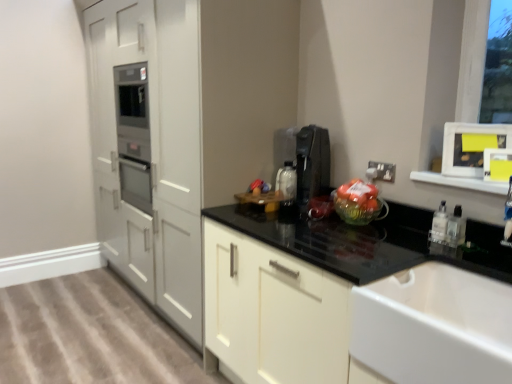
Question: Is white plastic electric outlet at upper right not inside clear plastic bottle at right, which is the 2th bottle from right to left?

Choices:
 (A) yes
 (B) no

Answer: (A)

Question: Is white plastic electric outlet at upper right at the left side of clear plastic bottle at right, the first bottle when ordered from left to right?

Choices:
 (A) no
 (B) yes

Answer: (B)

Question: Is clear plastic bottle at right, the first bottle when ordered from left to right, inside white plastic electric outlet at upper right?

Choices:
 (A) no
 (B) yes

Answer: (A)

Question: Is white plastic electric outlet at upper right in front of clear plastic bottle at right, which is the 2th bottle from right to left?

Choices:
 (A) no
 (B) yes

Answer: (A)

Question: Is white plastic electric outlet at upper right turned away from clear plastic bottle at right, the first bottle when ordered from left to right?

Choices:
 (A) yes
 (B) no

Answer: (B)

Question: Is translucent glass bowl at center inside the boundaries of black plastic coffee machine at upper right, or outside?

Choices:
 (A) inside
 (B) outside

Answer: (B)

Question: From a real-world perspective, relative to black plastic coffee machine at upper right, is translucent glass bowl at center vertically above or below?

Choices:
 (A) above
 (B) below

Answer: (B)

Question: Would you say translucent glass bowl at center is to the left or to the right of black plastic coffee machine at upper right in the picture?

Choices:
 (A) right
 (B) left

Answer: (A)

Question: Relative to black plastic coffee machine at upper right, is translucent glass bowl at center in front or behind?

Choices:
 (A) front
 (B) behind

Answer: (A)

Question: In terms of width, does black glossy countertop at center look wider or thinner when compared to black plastic coffee machine at upper right?

Choices:
 (A) wide
 (B) thin

Answer: (A)

Question: Do you think black glossy countertop at center is within black plastic coffee machine at upper right, or outside of it?

Choices:
 (A) inside
 (B) outside

Answer: (B)

Question: Based on their sizes in the image, would you say black glossy countertop at center is bigger or smaller than black plastic coffee machine at upper right?

Choices:
 (A) small
 (B) big

Answer: (B)

Question: Is point (395, 273) closer or farther from the camera than point (321, 162)?

Choices:
 (A) farther
 (B) closer

Answer: (B)

Question: Visually, is clear plastic bottle at right, the first bottle when ordered from left to right, positioned to the left or to the right of white plastic electric outlet at upper right?

Choices:
 (A) right
 (B) left

Answer: (A)

Question: Is clear plastic bottle at right, which is the 2th bottle from right to left, taller or shorter than white plastic electric outlet at upper right?

Choices:
 (A) tall
 (B) short

Answer: (A)